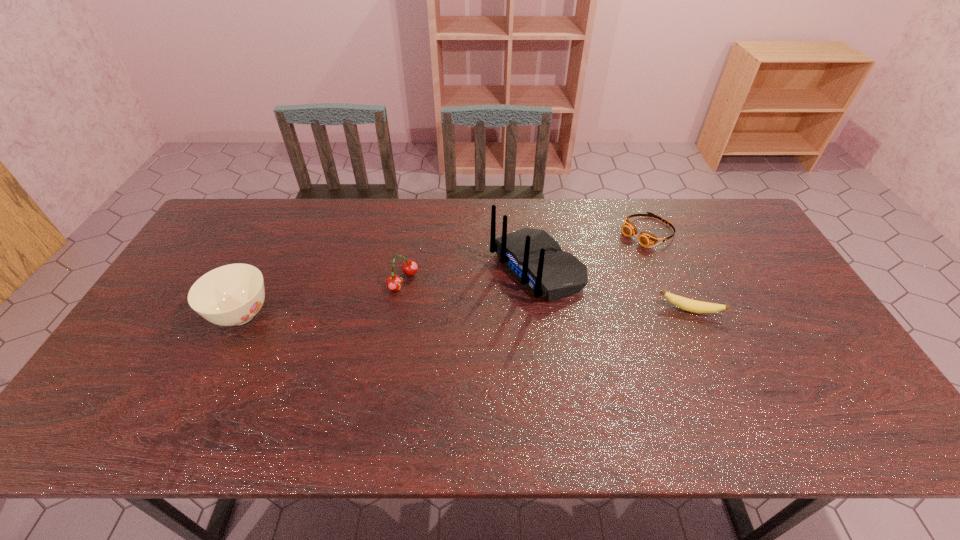
You are a GUI agent. You are given a task and a screenshot of the screen. Output one action in this format:
    pyautogui.click(x=<x>, y=<y>)
    Task: Click on the free space on the desktop that is between the sugar bowl and the banana and is positioned on the back of the tallest object
    The width and height of the screenshot is (960, 540).
    Given the screenshot: What is the action you would take?
    pyautogui.click(x=439, y=313)

Locate an element on the screen. vacant space on the desktop that is between the leftmost object and the banana and is positioned with the lenses facing forward on the goggles is located at coordinates (531, 312).

Locate an element on the screen. Image resolution: width=960 pixels, height=540 pixels. vacant space on the desktop that is between the leftmost object and the banana and is positioned with stems pointing upwards on the cherry is located at coordinates (465, 313).